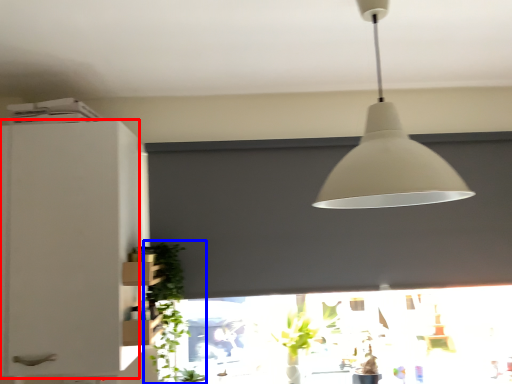
Question: Which of the following is the closest to the observer, cabinetry (highlighted by a red box) or plant (highlighted by a blue box)?

Choices:
 (A) cabinetry
 (B) plant

Answer: (A)